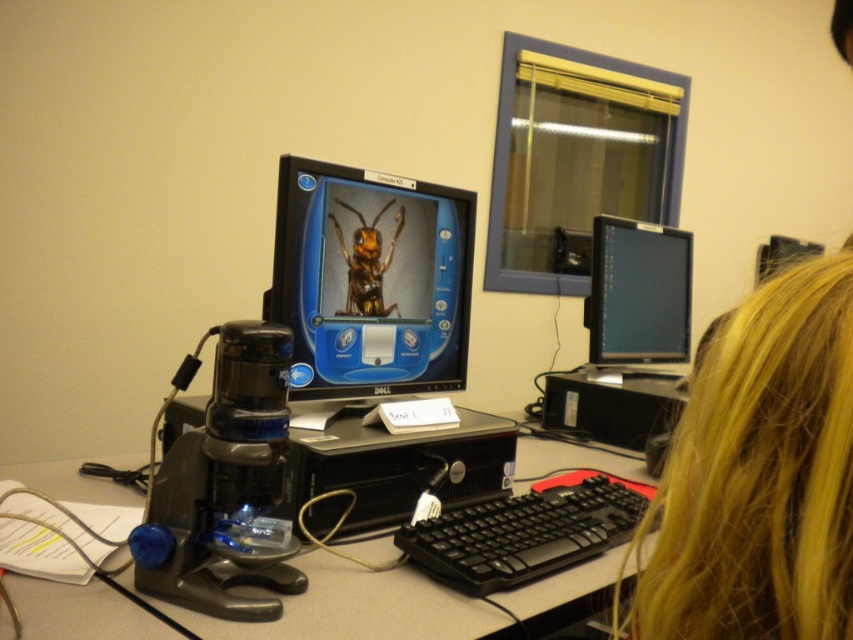
Looking at this image, you are setting up a new workspace and have a matte black monitor at center and a black plastic keyboard at lower center. Where should you place your mouse to ensure it is easily accessible while using both devices?

The mouse should be placed next to the black plastic keyboard at lower center since it is positioned below the matte black monitor at center, allowing for easy access to both devices.

You are a delivery person who just arrived at a modern office. You need to place a new monitor that is 1.2 meters wide on the desk. The current desk has a matte black monitor at center. Can the new monitor fit on the desk without moving any existing items?

The matte black monitor at center is 1.08 meters from camera. The new monitor is 1.2 meters wide. Since the distance from the camera does not indicate the desk space available, we cannot determine if the new monitor will fit without additional information about the desk dimensions or the placement of other items.